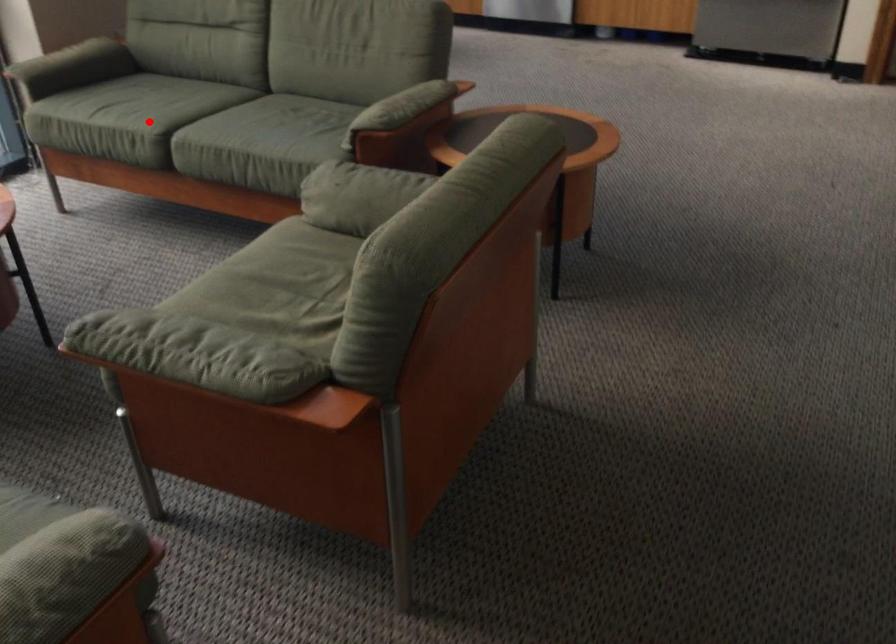
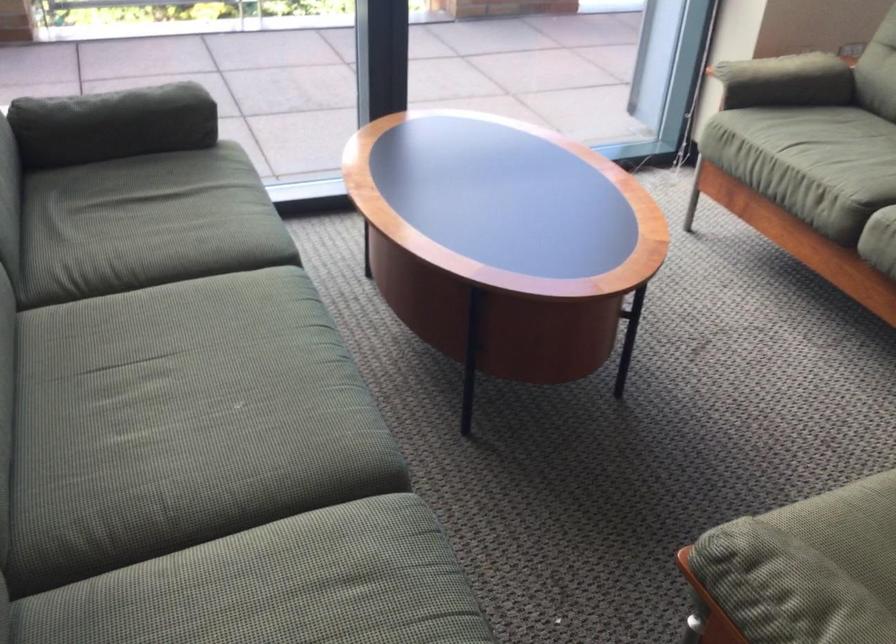
Question: I am providing you with two images of the same scene from different viewpoints. A red point is marked on the first image. At the location where the point appears in image 1, is it still visible in image 2?

Choices:
 (A) Yes
 (B) No

Answer: (A)